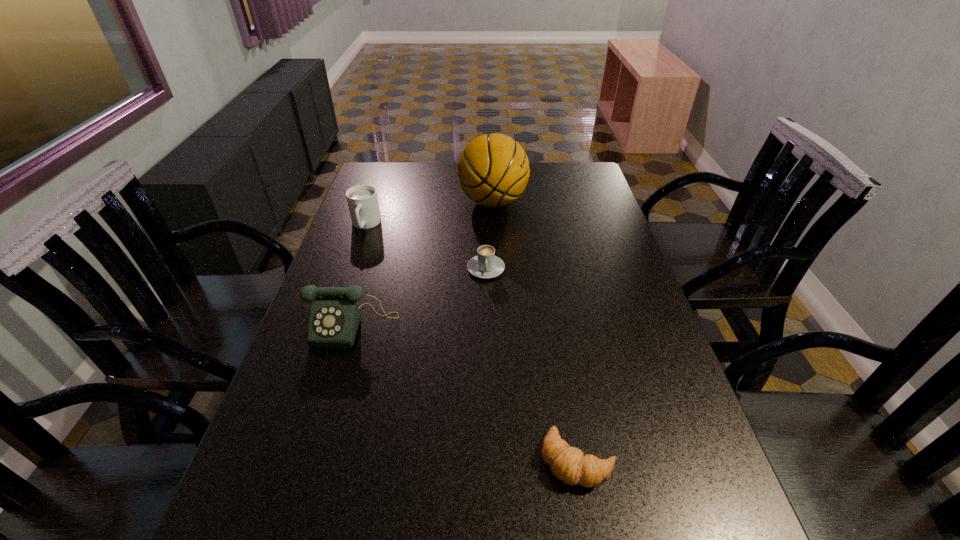
Locate an element on the screen. The height and width of the screenshot is (540, 960). vacant space located on the surface of the basketball near the brand logo is located at coordinates pyautogui.click(x=417, y=202).

The height and width of the screenshot is (540, 960). I want to click on free point located 0.060m on the dial of the telephone, so click(340, 370).

Locate an element on the screen. This screenshot has width=960, height=540. vacant region located 0.140m on the side with the handle of the farther cappuccino is located at coordinates (351, 266).

You are a GUI agent. You are given a task and a screenshot of the screen. Output one action in this format:
    pyautogui.click(x=<x>, y=<y>)
    Task: Click on the vacant space located to the right of the right cappuccino
    
    Given the screenshot: What is the action you would take?
    pyautogui.click(x=488, y=388)

Find the location of a particular element. The width and height of the screenshot is (960, 540). free region located on the left of the shortest object is located at coordinates click(x=428, y=460).

Locate an element on the screen. The image size is (960, 540). object that is at the far edge is located at coordinates (493, 170).

Identify the location of telephone located at the left edge. The image size is (960, 540). (334, 317).

I want to click on cappuccino that is at the left edge, so click(x=362, y=200).

Identify the location of free space at the far edge. (531, 170).

In the image, there is a desktop. Identify the location of vacant space at the left edge. Image resolution: width=960 pixels, height=540 pixels. (325, 399).